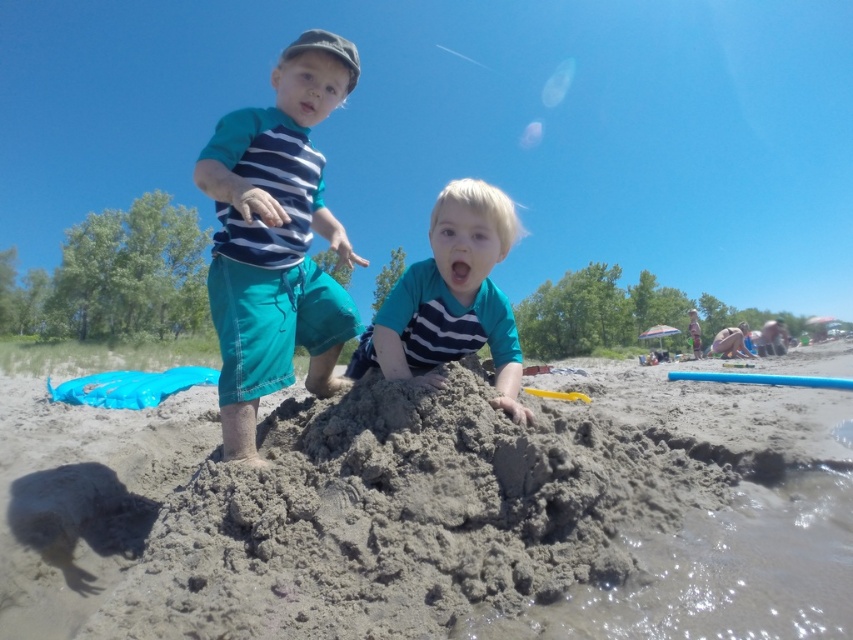
Between point (85, 483) and point (320, 108), which one is positioned behind?

Positioned behind is point (85, 483).

Based on the photo, measure the distance between gray sandcastle at center and camera.

gray sandcastle at center and camera are 1.77 meters apart from each other.

At what (x,y) coordinates should I click in order to perform the action: click on gray sandcastle at center. Please return your answer as a coordinate pair (x, y). The height and width of the screenshot is (640, 853). Looking at the image, I should click on coord(431,515).

Can you confirm if matte blue shorts at center is wider than matte teal shirt at center?

Yes, matte blue shorts at center is wider than matte teal shirt at center.

Does matte blue shorts at center appear under matte teal shirt at center?

No.

Between point (277, 314) and point (434, 252), which one is positioned in front?

Point (277, 314) is more forward.

This screenshot has height=640, width=853. In order to click on matte blue shorts at center in this screenshot , I will do `click(276, 237)`.

Is gray sandcastle at center positioned at the back of matte teal shirt at center?

No, it is not.

Between point (633, 385) and point (419, 344), which one is positioned in front?

Point (419, 344) is more forward.

Measure the distance between gray sandcastle at center and camera.

1.77 meters

The image size is (853, 640). What are the coordinates of `gray sandcastle at center` in the screenshot? It's located at point(431,515).